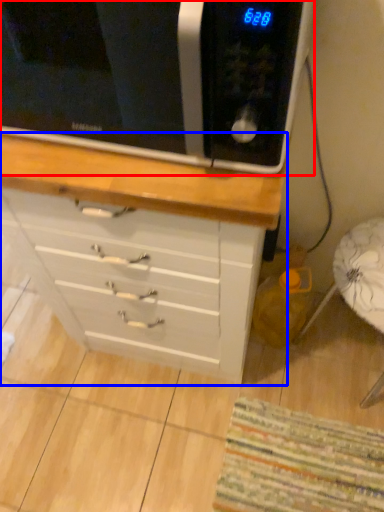
Question: Among these objects, which one is farthest to the camera, microwave oven (highlighted by a red box) or chest of drawers (highlighted by a blue box)?

Choices:
 (A) microwave oven
 (B) chest of drawers

Answer: (B)